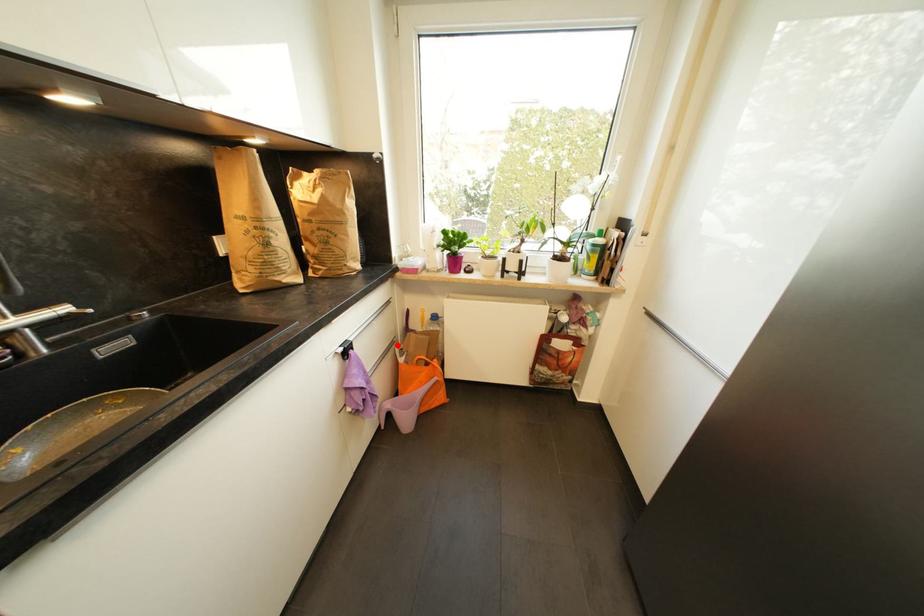
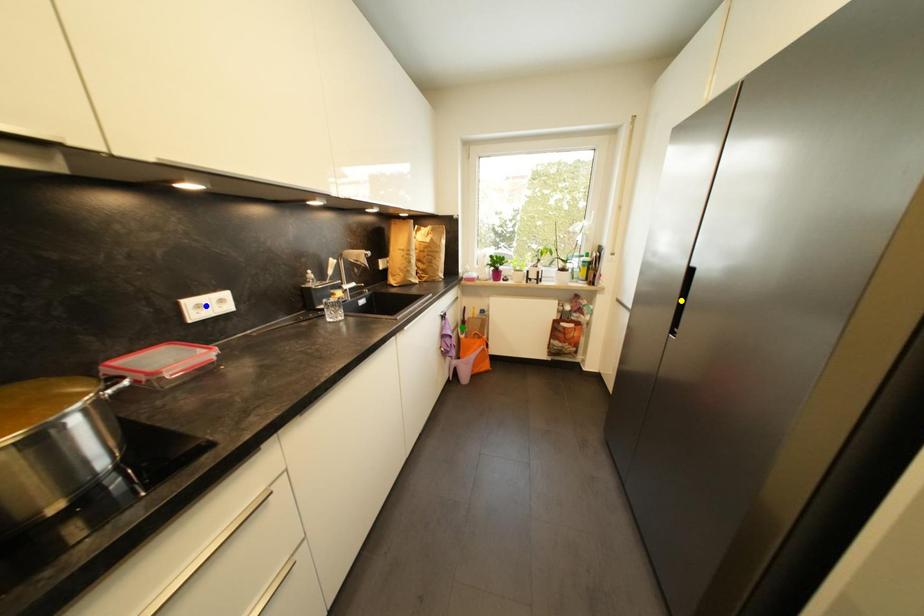
Question: I am providing you with two images of the same scene from different viewpoints. A red point is marked on the first image. You are given multiple points on the second image. Which mark in image 2 goes with the point in image 1?

Choices:
 (A) green point
 (B) blue point
 (C) yellow point

Answer: (A)